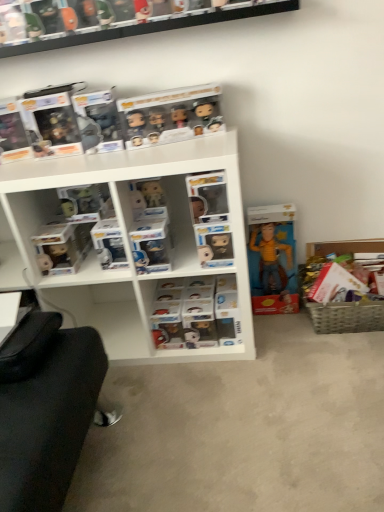
Where is `vacant space positioned to the left of woven basket at lower right`? Image resolution: width=384 pixels, height=512 pixels. vacant space positioned to the left of woven basket at lower right is located at coordinates (297, 341).